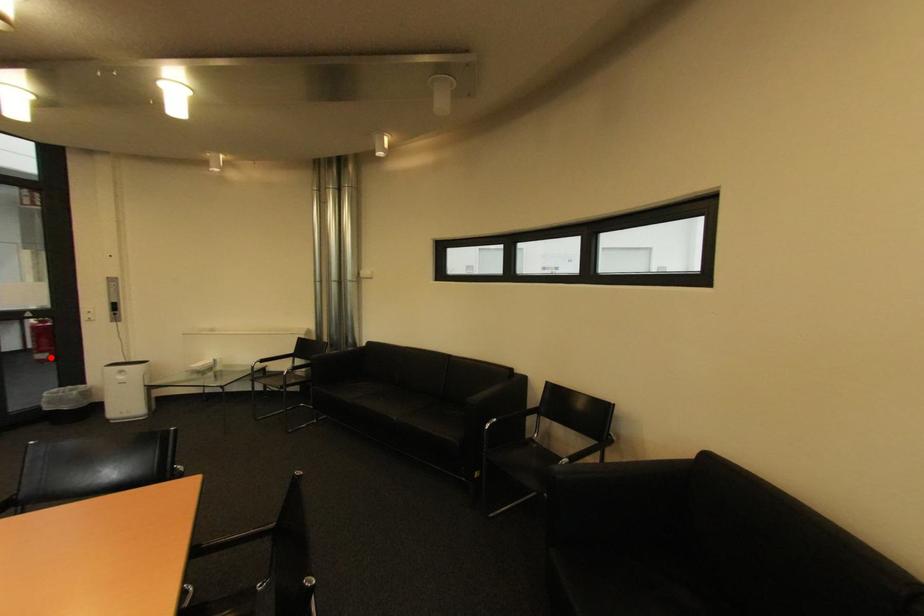
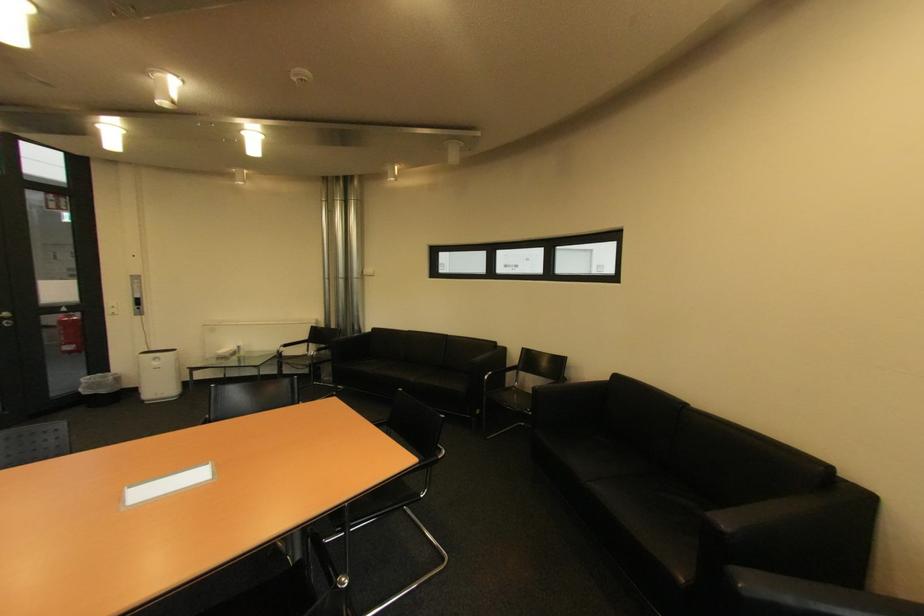
Question: I am providing you with two images of the same scene from different viewpoints. In image1, a red point is highlighted. Considering the same 3D point in image2, which of the following is correct?

Choices:
 (A) It is closer
 (B) It is farther

Answer: (A)